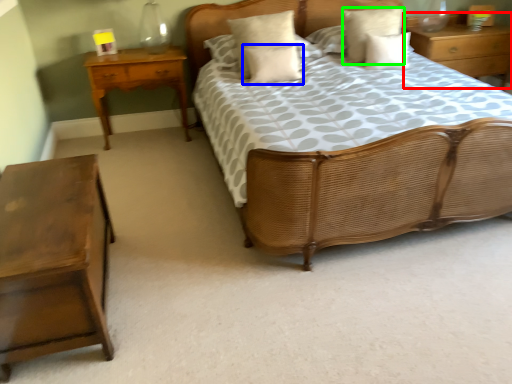
Question: Which is farther away from nightstand (highlighted by a red box)? pillow (highlighted by a blue box) or pillow (highlighted by a green box)?

Choices:
 (A) pillow
 (B) pillow

Answer: (A)